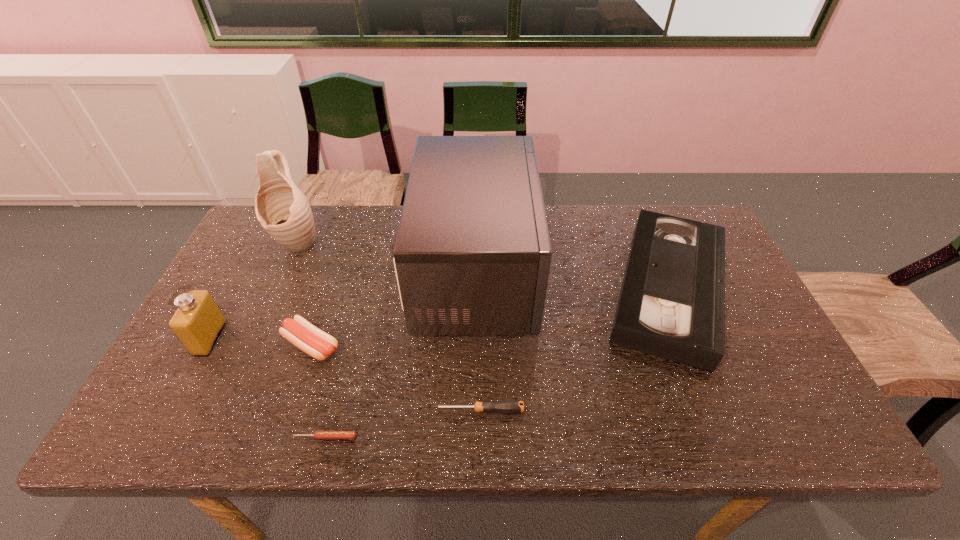
You are a GUI agent. You are given a task and a screenshot of the screen. Output one action in this format:
    pyautogui.click(x=<x>, y=<y>)
    Task: Click on the shorter sausage
    
    Given the screenshot: What is the action you would take?
    pyautogui.click(x=319, y=434)

The image size is (960, 540). Identify the location of the nearer sausage. (319, 434).

Where is `free space located 0.090m at the spout of the pitcher`? The height and width of the screenshot is (540, 960). free space located 0.090m at the spout of the pitcher is located at coordinates (280, 283).

Image resolution: width=960 pixels, height=540 pixels. Identify the location of free space located 0.200m on the front-facing side of the microwave oven. (607, 271).

Find the location of a particular element. The height and width of the screenshot is (540, 960). free space located on the front-facing side of the perfume is located at coordinates (259, 339).

The image size is (960, 540). I want to click on free spot located on the front of the fourth tallest object, so click(x=711, y=392).

Locate an element on the screen. This screenshot has width=960, height=540. vacant area situated 0.250m on the right of the taller sausage is located at coordinates (442, 345).

Identify the location of free region located on the left of the second shortest object. (293, 410).

Find the location of a particular element. Image resolution: width=960 pixels, height=540 pixels. free region located 0.150m on the left of the nearer sausage is located at coordinates (224, 437).

Locate an element on the screen. This screenshot has width=960, height=540. pitcher that is positioned at the far edge is located at coordinates (282, 209).